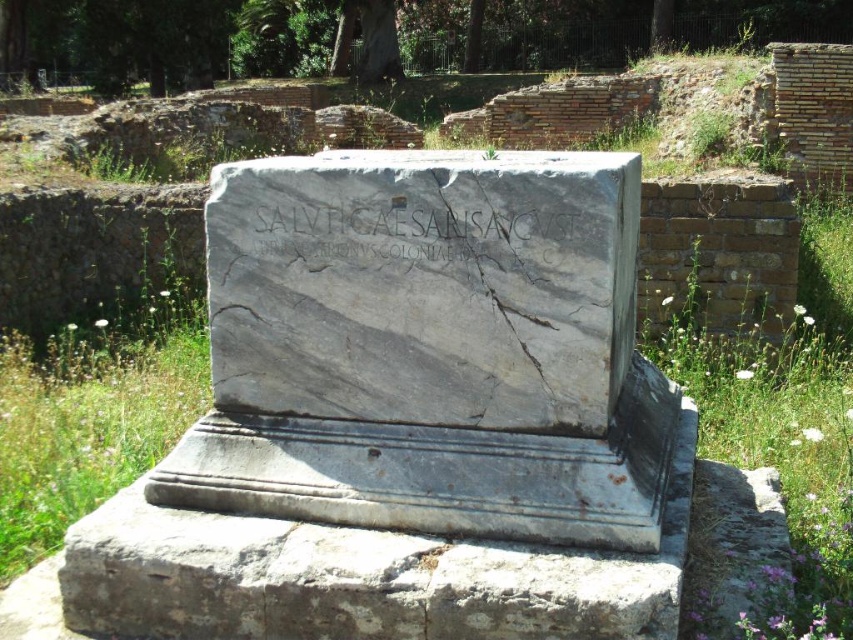
You are an archaeologist examining the ancient stone monument. You notice two gray marble elements at the center of the monument. One is labeled as the gray marble stone at center and the other as the gray marble inscription at center. Based on their positions, which one is located higher up on the monument?

The gray marble inscription at center is located higher up because the gray marble stone at center is positioned below it.